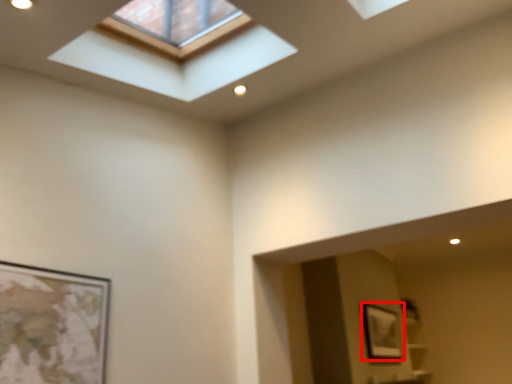
Question: From the image, what is the correct spatial relationship of picture frame (annotated by the red box) in relation to window?

Choices:
 (A) right
 (B) left

Answer: (A)